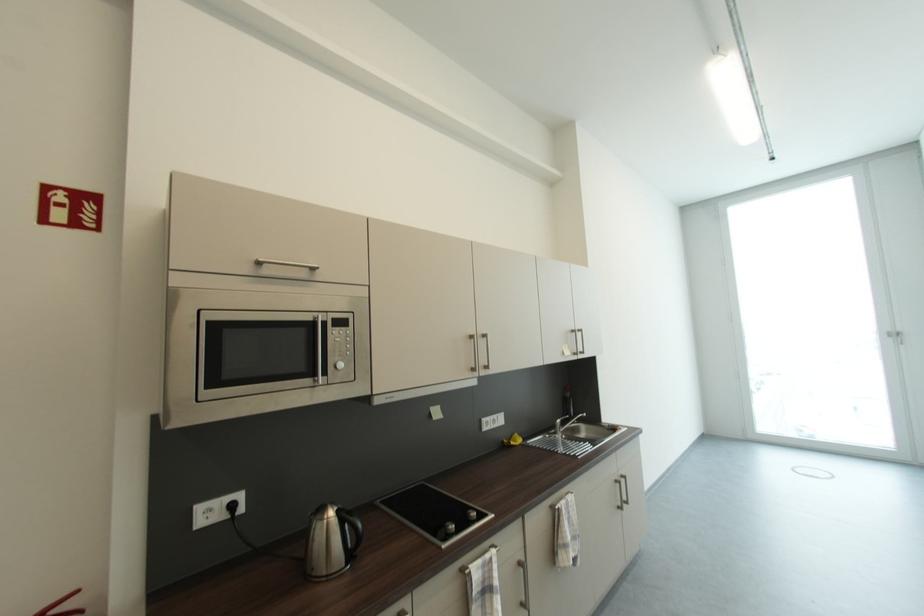
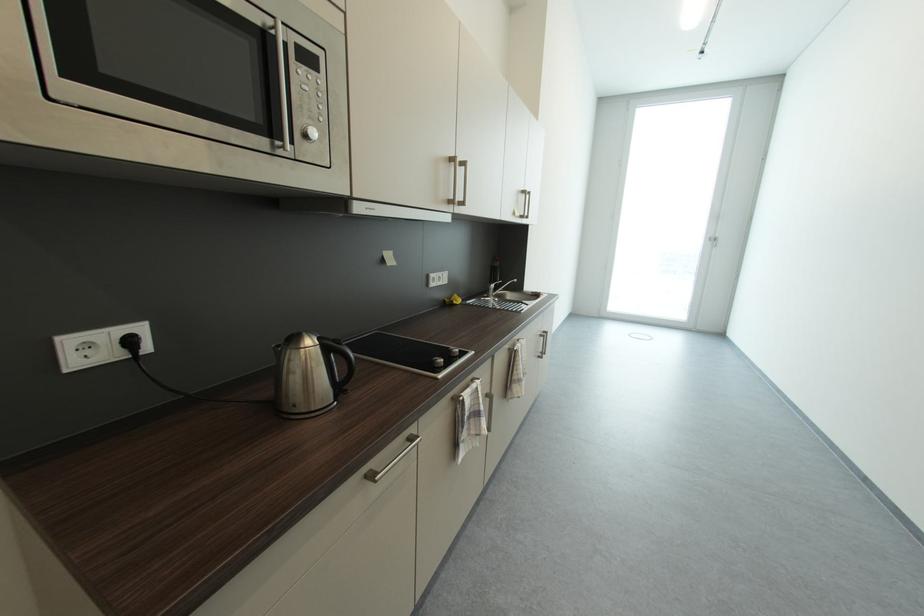
What movement of the cameraman would produce the second image?

The cameraman walked toward left, forward.